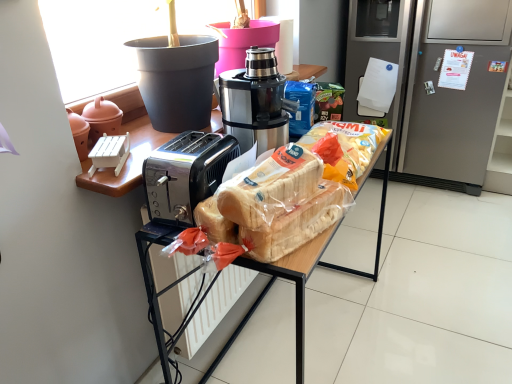
Question: Considering the relative sizes of silver metallic refrigerator at right and translucent plastic bread at center in the image provided, is silver metallic refrigerator at right thinner than translucent plastic bread at center?

Choices:
 (A) yes
 (B) no

Answer: (B)

Question: Considering the relative sizes of silver metallic refrigerator at right and translucent plastic bread at center in the image provided, is silver metallic refrigerator at right taller than translucent plastic bread at center?

Choices:
 (A) yes
 (B) no

Answer: (A)

Question: From a real-world perspective, is silver metallic refrigerator at right on top of translucent plastic bread at center?

Choices:
 (A) no
 (B) yes

Answer: (A)

Question: Does silver metallic refrigerator at right lie behind translucent plastic bread at center?

Choices:
 (A) yes
 (B) no

Answer: (A)

Question: Are silver metallic refrigerator at right and translucent plastic bread at center far apart?

Choices:
 (A) no
 (B) yes

Answer: (B)

Question: In terms of width, does translucent plastic bread at center look wider or thinner when compared to matte black toaster at center?

Choices:
 (A) wide
 (B) thin

Answer: (B)

Question: From a real-world perspective, is translucent plastic bread at center physically located above or below matte black toaster at center?

Choices:
 (A) above
 (B) below

Answer: (A)

Question: In the image, is translucent plastic bread at center on the left side or the right side of matte black toaster at center?

Choices:
 (A) left
 (B) right

Answer: (A)

Question: Is point (268, 215) positioned closer to the camera than point (294, 251)?

Choices:
 (A) closer
 (B) farther

Answer: (A)

Question: From a real-world perspective, relative to matte pink pot at left, is satin black coffee maker at center vertically above or below?

Choices:
 (A) above
 (B) below

Answer: (A)

Question: Visually, is satin black coffee maker at center positioned to the left or to the right of matte pink pot at left?

Choices:
 (A) left
 (B) right

Answer: (B)

Question: Considering the positions of satin black coffee maker at center and matte pink pot at left in the image, is satin black coffee maker at center wider or thinner than matte pink pot at left?

Choices:
 (A) wide
 (B) thin

Answer: (A)

Question: Is point (262, 49) closer or farther from the camera than point (100, 104)?

Choices:
 (A) closer
 (B) farther

Answer: (A)

Question: From a real-world perspective, is matte black toaster at center positioned above or below matte pink pot at left?

Choices:
 (A) below
 (B) above

Answer: (A)

Question: From their relative heights in the image, would you say matte black toaster at center is taller or shorter than matte pink pot at left?

Choices:
 (A) tall
 (B) short

Answer: (A)